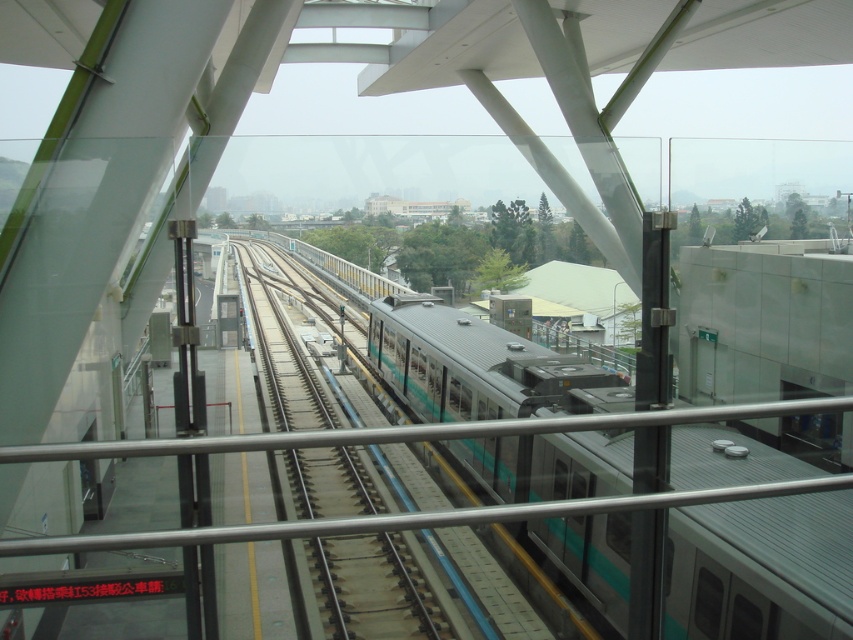
In the scene shown: You are standing at the point marked as point (842, 592) on the platform. A maintenance worker needs to reach you with a cart that can only move in straight lines and cannot navigate around obstacles. Is the path from the worker to your current position clear of any obstacles? Please state your answer based on the scene description provided.

The scene description mentions a sleek metallic railing in the foreground and a train track leading into the distance with a stationary train. There are no obstacles mentioned between the worker and point (842, 592), so the path is clear.